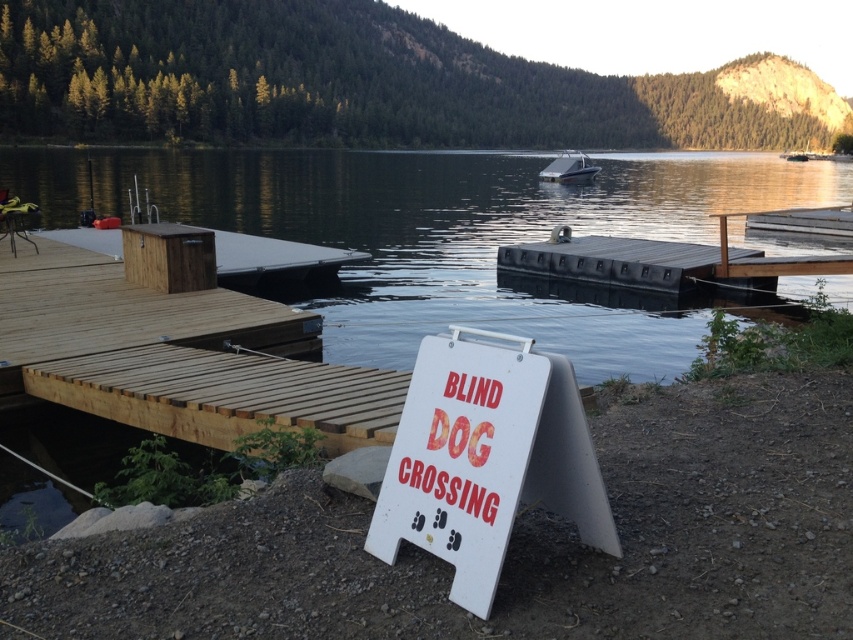
You are standing at the edge of the wooden dock and want to reach the floating platform in the middle of the lake. There is a point marked at coordinates (469,237) which is transparent water at center. Can you safely walk from the dock to the platform without stepping into the transparent water?

The point marked at coordinates (469,237) is transparent water at center, so you should avoid that area. To safely reach the floating platform, walk along the dock until you reach the platform itself, as the transparent water at that point indicates it is not solid ground.

You are a boater approaching the dock and see the white paper sign at center and the white glossy boat at center. Which object is positioned to the left when facing the dock?

The white paper sign at center is to the left of the white glossy boat at center when facing the dock.